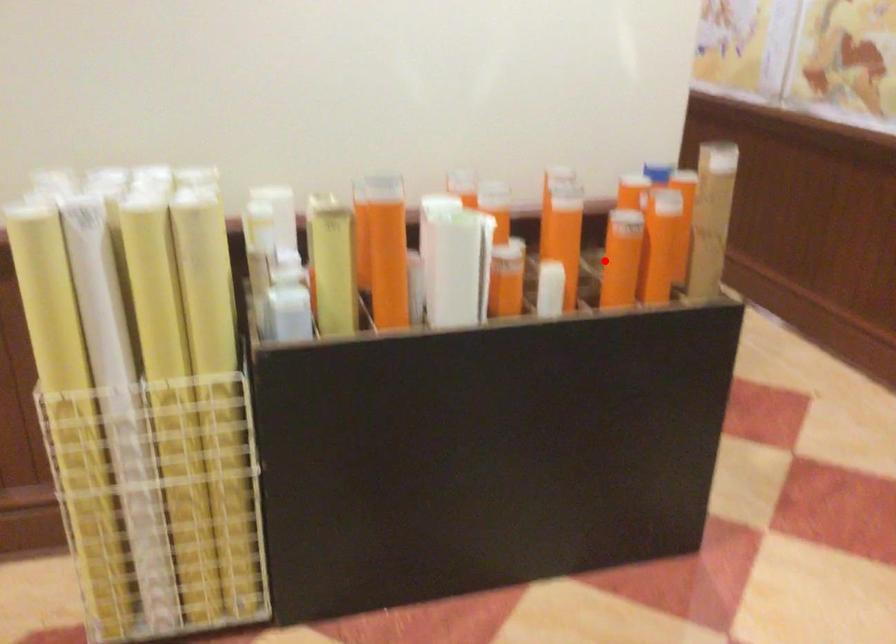
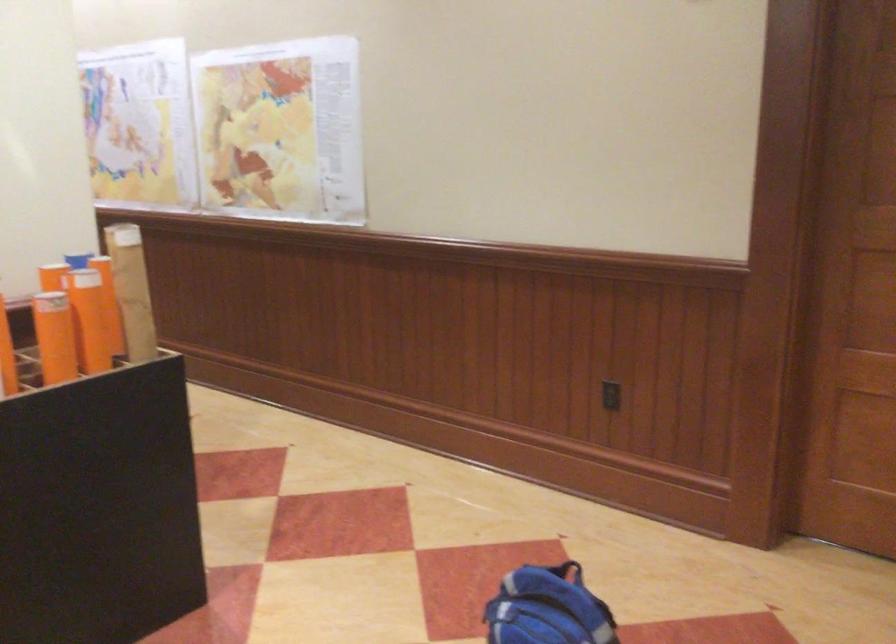
Find the pixel in the second image that matches the highlighted location in the first image.

(55, 337)